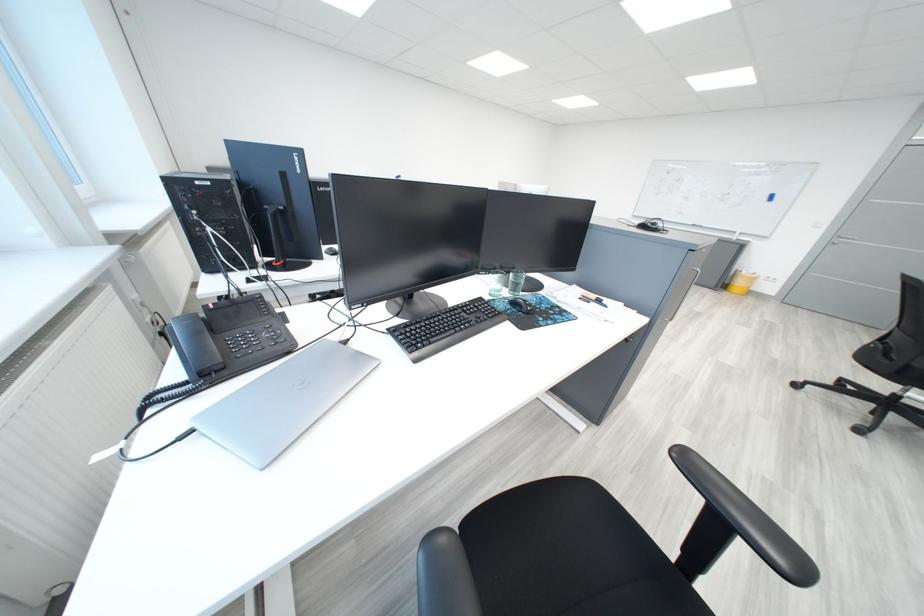
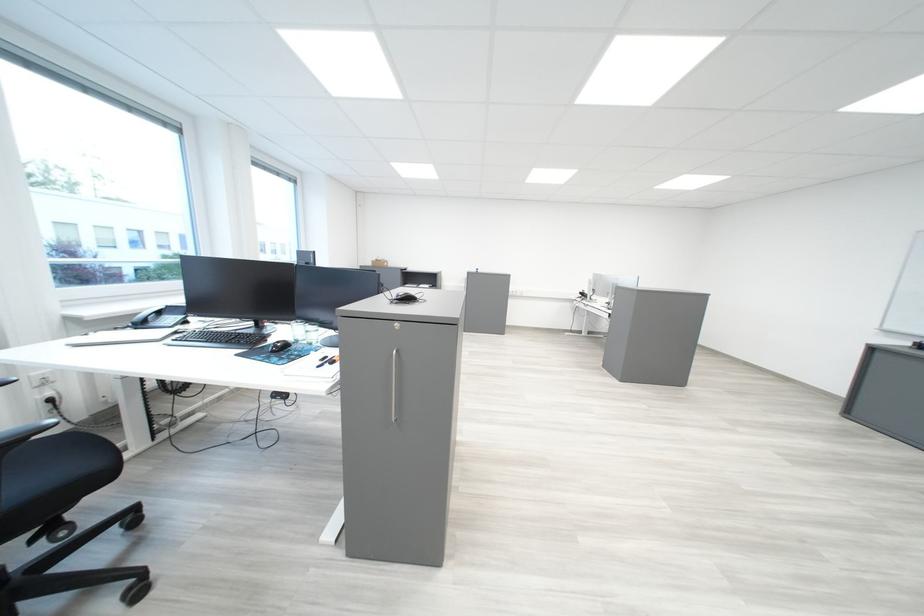
Question: I am providing you with two images of the same scene from different viewpoints. Which of the following objects are not visible in image2?

Choices:
 (A) green round stool
 (B) black telephone handset
 (C) metal cabinet handle
 (D) telephone handset

Answer: (B)